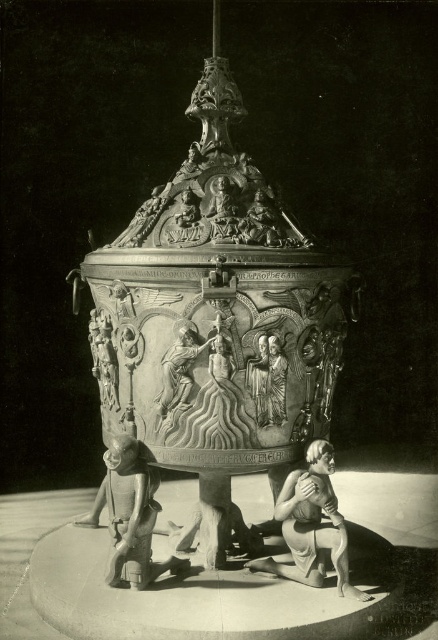
Is polished bronze baptismal font at center behind bronze relief figure at center?

No.

The width and height of the screenshot is (438, 640). In order to click on polished bronze baptismal font at center in this screenshot , I will do `click(218, 317)`.

Between polished bronze baptismal font at center and polished bronze figure at lower left, which one has less height?

polished bronze figure at lower left

This screenshot has height=640, width=438. In order to click on polished bronze baptismal font at center in this screenshot , I will do `click(218, 317)`.

Image resolution: width=438 pixels, height=640 pixels. I want to click on polished bronze baptismal font at center, so click(x=218, y=317).

Who is positioned more to the left, polished bronze baptismal font at center or matte bronze statue at lower center?

polished bronze baptismal font at center

Who is shorter, polished bronze baptismal font at center or matte bronze statue at lower center?

matte bronze statue at lower center is shorter.

What are the coordinates of `polished bronze baptismal font at center` in the screenshot? It's located at (218, 317).